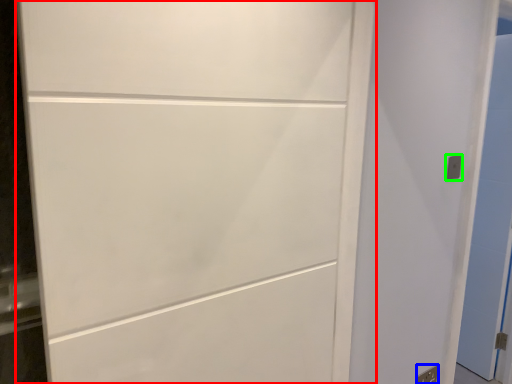
Question: Estimate the real-world distances between objects in this image. Which object is farther from door (highlighted by a red box), electric outlet (highlighted by a blue box) or electric outlet (highlighted by a green box)?

Choices:
 (A) electric outlet
 (B) electric outlet

Answer: (A)